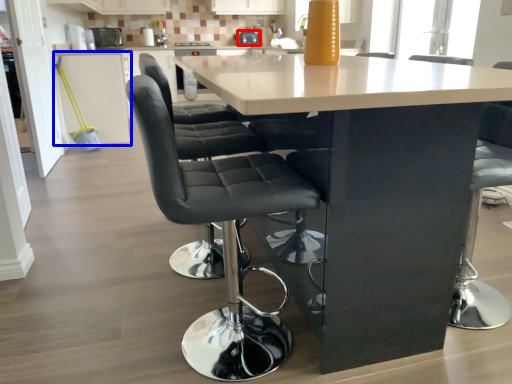
Question: Which object appears closest to the camera in this image, appliance (highlighted by a red box) or cabinetry (highlighted by a blue box)?

Choices:
 (A) appliance
 (B) cabinetry

Answer: (B)